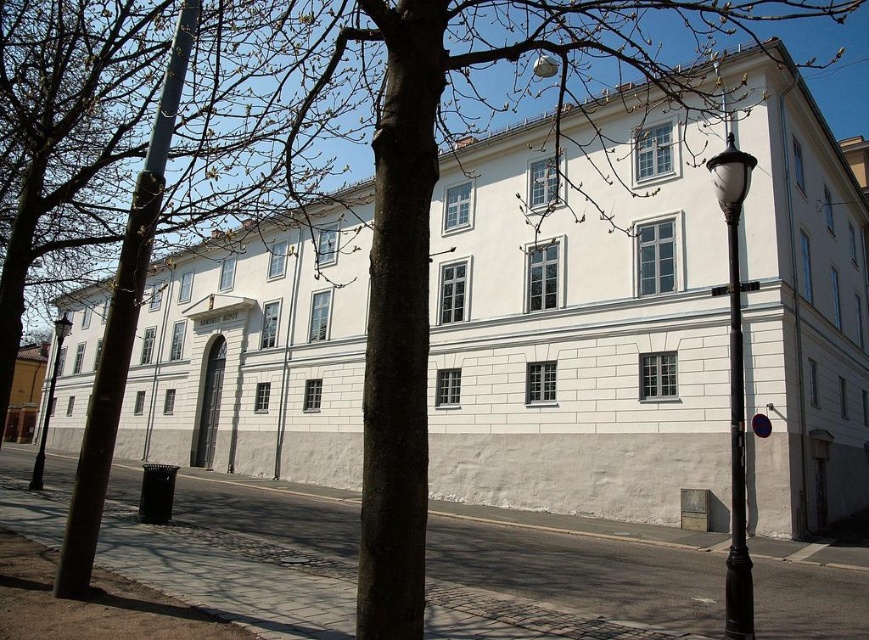
You are a city planner assessing the symmetry of the building. Given the presence of the metallic pole at left and the black metal lamp post at right, which one would you consider more appropriate to maintain the classical symmetry of the building?

The metallic pole at left is thinner than the black metal lamp post at right. To maintain classical symmetry, the poles on both sides should be of equal thickness. Therefore, replacing the thicker black metal lamp post at right with a pole of the same thickness as the metallic pole at left would better preserve the building symmetry.

You are a city planner assessing the symmetry of the building. You notice two objects near the entrance. Which object is shorter between the black polished metal pole at right and the black glass lamp post at left?

The black polished metal pole at right is shorter than the black glass lamp post at left.

You are standing in front of the building and need to determine which object is taller between the metallic pole at left and the black metal lamp post at right. Which one is taller?

The black metal lamp post at right is taller than the metallic pole at left.